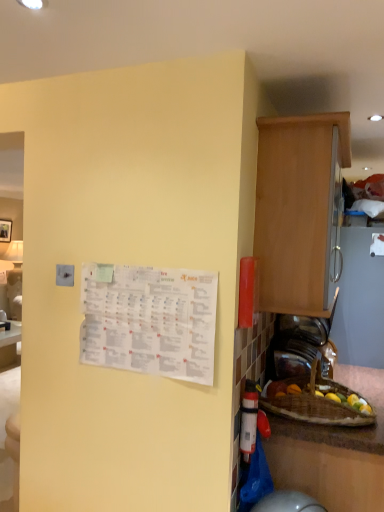
Question: From a real-world perspective, is light brown wood cabinet at right physically located above or below white paper calendar at upper left?

Choices:
 (A) below
 (B) above

Answer: (B)

Question: In terms of size, does light brown wood cabinet at right appear bigger or smaller than white paper calendar at upper left?

Choices:
 (A) small
 (B) big

Answer: (B)

Question: In terms of width, does light brown wood cabinet at right look wider or thinner when compared to white paper calendar at upper left?

Choices:
 (A) thin
 (B) wide

Answer: (B)

Question: From the image's perspective, is white paper calendar at upper left above or below light brown wood cabinet at right?

Choices:
 (A) below
 (B) above

Answer: (A)

Question: Based on their sizes in the image, would you say white paper calendar at upper left is bigger or smaller than light brown wood cabinet at right?

Choices:
 (A) small
 (B) big

Answer: (A)

Question: Do you think white paper calendar at upper left is within light brown wood cabinet at right, or outside of it?

Choices:
 (A) inside
 (B) outside

Answer: (B)

Question: From their relative heights in the image, would you say white paper calendar at upper left is taller or shorter than light brown wood cabinet at right?

Choices:
 (A) tall
 (B) short

Answer: (B)